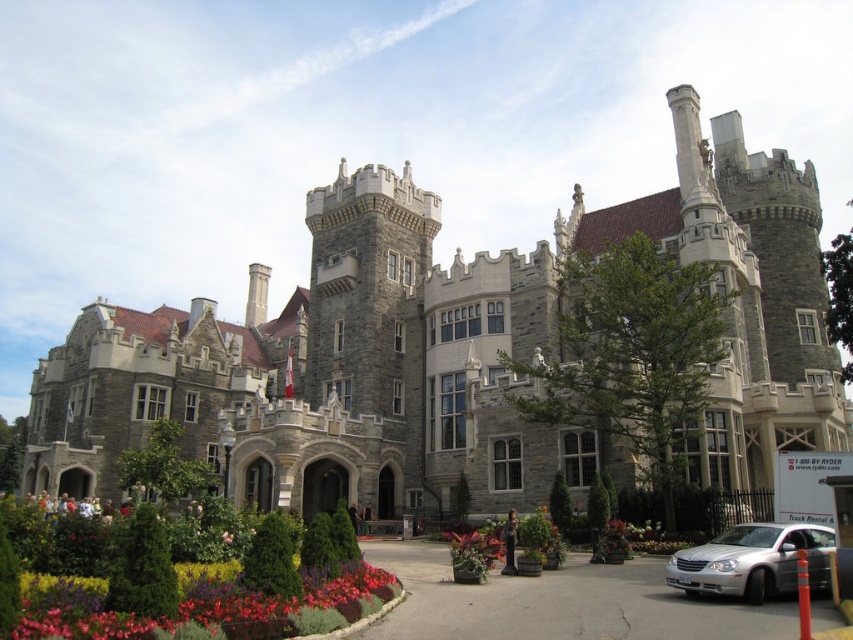
What do you see at coordinates (231, 614) in the screenshot?
I see `vivid multicolored flowers at lower center` at bounding box center [231, 614].

Is point (357, 588) positioned in front of point (228, 541)?

Yes, it is in front of point (228, 541).

Between point (347, 592) and point (229, 534), which one is positioned in front?

Point (347, 592) is in front.

You are a GUI agent. You are given a task and a screenshot of the screen. Output one action in this format:
    pyautogui.click(x=<x>, y=<y>)
    Task: Click on the vivid multicolored flowers at lower center
    
    Given the screenshot: What is the action you would take?
    pyautogui.click(x=231, y=614)

How much distance is there between vivid multicolored flowers at lower center and green textured planter at lower center?

vivid multicolored flowers at lower center and green textured planter at lower center are 15.93 meters apart.

Does vivid multicolored flowers at lower center come in front of green textured planter at lower center?

Yes, it is in front of green textured planter at lower center.

Locate an element on the screen. This screenshot has height=640, width=853. vivid multicolored flowers at lower center is located at coordinates (231, 614).

Which is above, silver metallic sedan at lower right or pink matte flower at center?

Positioned higher is silver metallic sedan at lower right.

The height and width of the screenshot is (640, 853). What do you see at coordinates (753, 561) in the screenshot?
I see `silver metallic sedan at lower right` at bounding box center [753, 561].

Between point (799, 544) and point (228, 541), which one is positioned in front?

Point (799, 544)

I want to click on silver metallic sedan at lower right, so click(x=753, y=561).